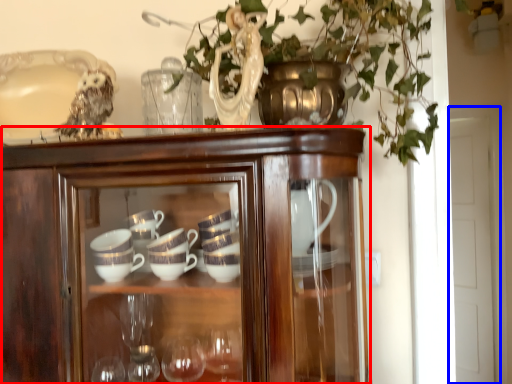
Question: Among these objects, which one is nearest to the camera, cupboard (highlighted by a red box) or glass door (highlighted by a blue box)?

Choices:
 (A) cupboard
 (B) glass door

Answer: (A)